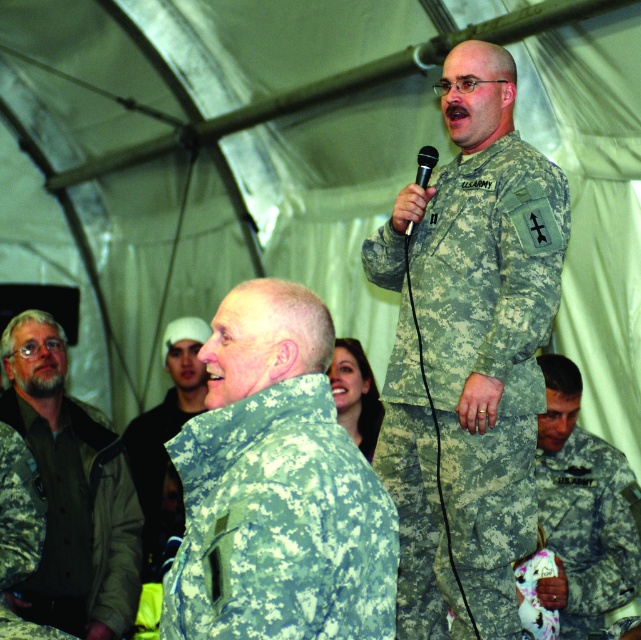
Question: In this image, where is camouflage fabric uniform at upper center located relative to camouflage fabric jacket at center?

Choices:
 (A) above
 (B) below

Answer: (A)

Question: Does camouflage fabric jacket at center appear under black plastic microphone at upper center?

Choices:
 (A) no
 (B) yes

Answer: (B)

Question: Which of these objects is positioned farthest from the camouflage uniform at lower right?

Choices:
 (A) camouflage fabric uniform at upper center
 (B) camouflage fabric jacket at center
 (C) green camouflage jacket at lower left

Answer: (B)

Question: Which of these objects is positioned closest to the green camouflage jacket at lower left?

Choices:
 (A) camouflage uniform at center
 (B) camouflage uniform at lower right
 (C) camouflage fabric jacket at center

Answer: (A)

Question: Does camouflage uniform at center appear on the right side of black plastic microphone at upper center?

Choices:
 (A) no
 (B) yes

Answer: (A)

Question: Which point is closer to the camera?

Choices:
 (A) camouflage fabric uniform at upper center
 (B) black plastic microphone at upper center
 (C) green camouflage jacket at lower left

Answer: (A)